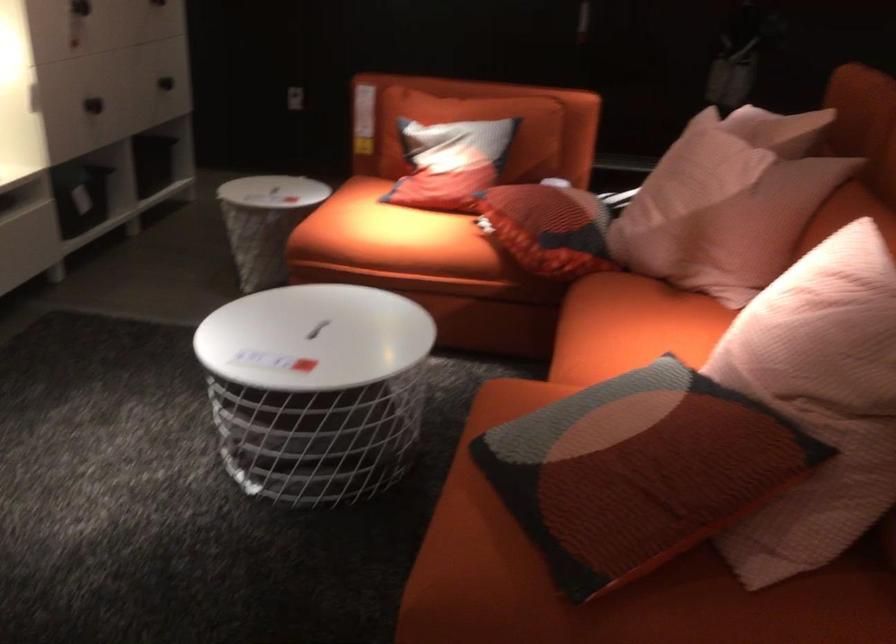
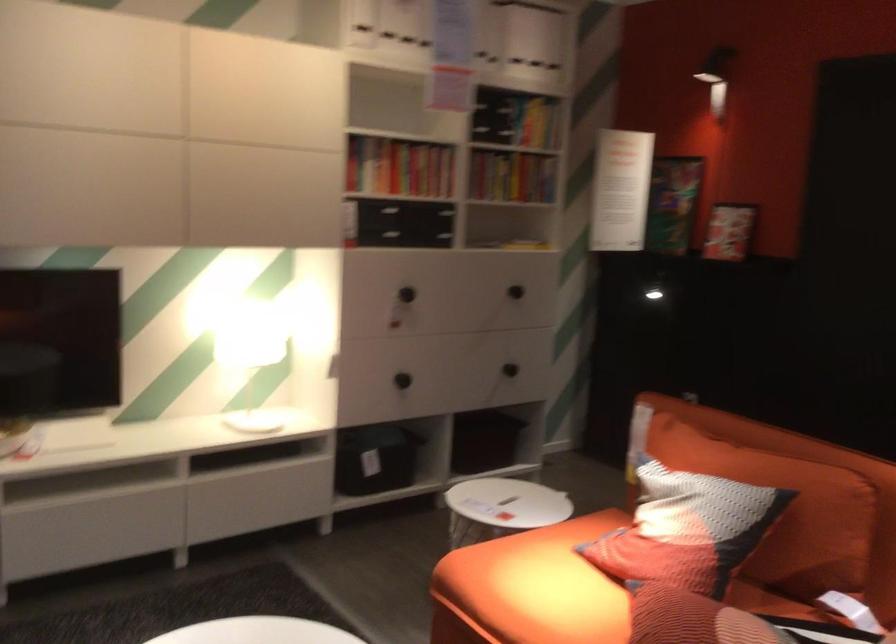
The point at [95,106] is marked in the first image. Where is the corresponding point in the second image?

(401, 380)